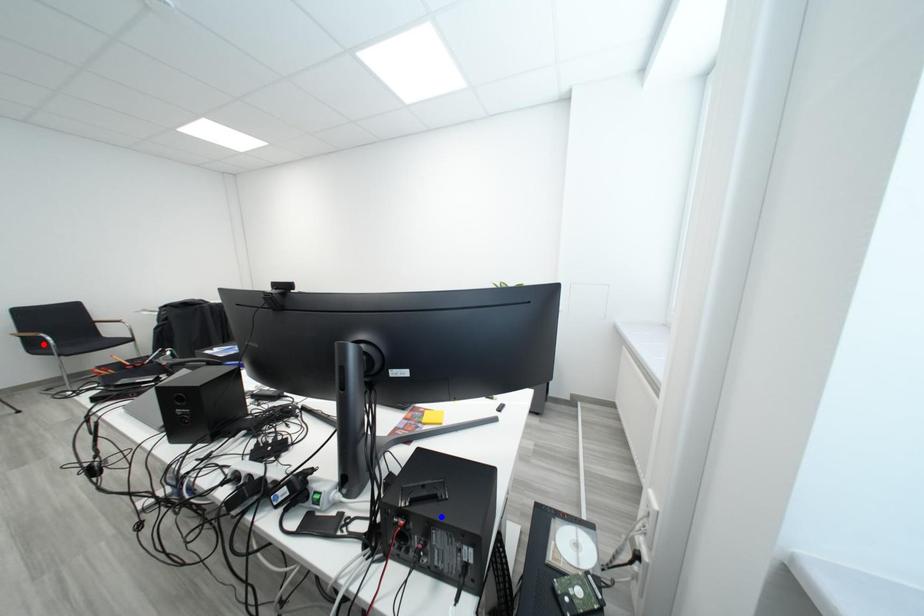
Question: Two points are marked on the image. Which point is closer to the camera?

Choices:
 (A) Blue point is closer.
 (B) Red point is closer.

Answer: (A)